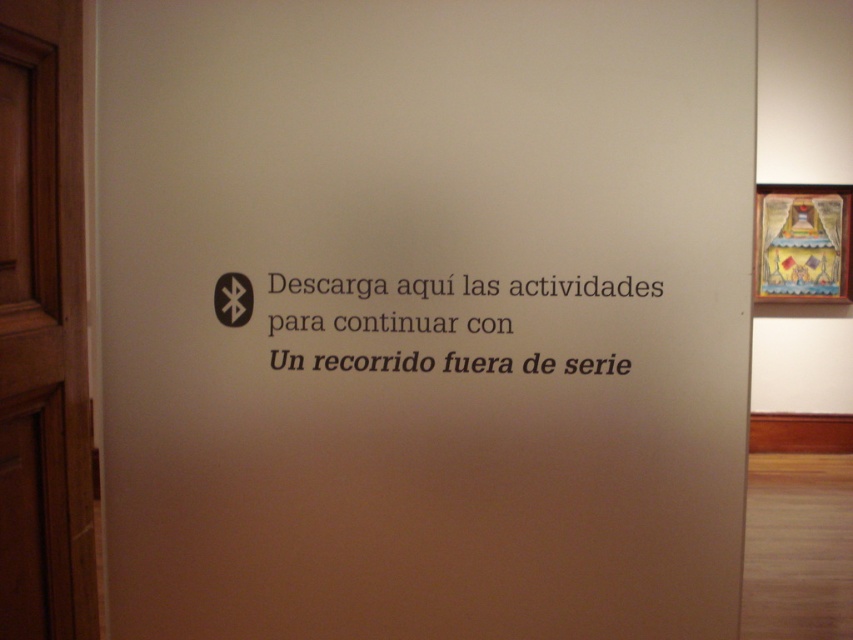
Question: Does brown wooden door at left have a lesser width compared to wooden painted artwork at upper right?

Choices:
 (A) no
 (B) yes

Answer: (B)

Question: Is brown wooden door at left bigger than black paper text at center?

Choices:
 (A) yes
 (B) no

Answer: (A)

Question: Which of the following is the closest to the observer?

Choices:
 (A) (0, 502)
 (B) (659, 291)
 (C) (808, 241)

Answer: (A)

Question: Which point is closer to the camera?

Choices:
 (A) (53, 609)
 (B) (793, 257)

Answer: (A)

Question: Which object is closer to the camera taking this photo?

Choices:
 (A) black paper text at center
 (B) wooden painted artwork at upper right

Answer: (A)

Question: Can you confirm if wooden painted artwork at upper right is positioned below black paper text at center?

Choices:
 (A) no
 (B) yes

Answer: (A)